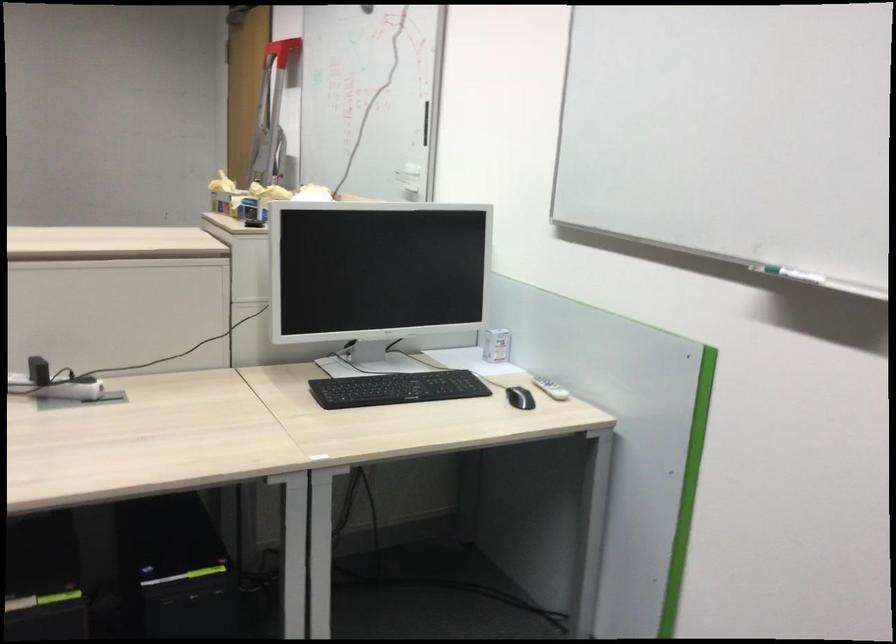
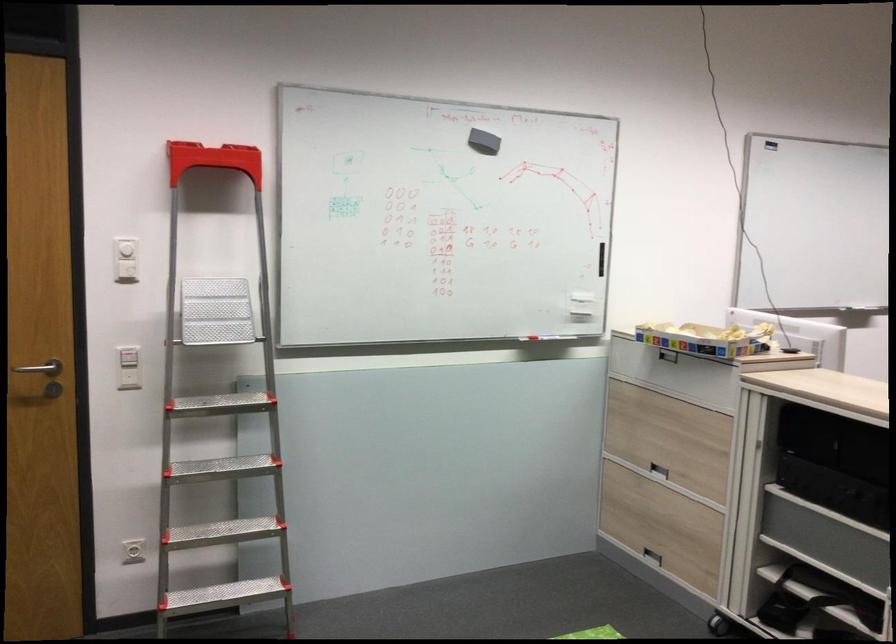
Question: I am providing you with two images of the same scene from different viewpoints. Please identify which objects are invisible in image2.

Choices:
 (A) red whiteboard marker
 (B) red and green handle
 (C) white wall button
 (D) black computer mouse

Answer: (D)